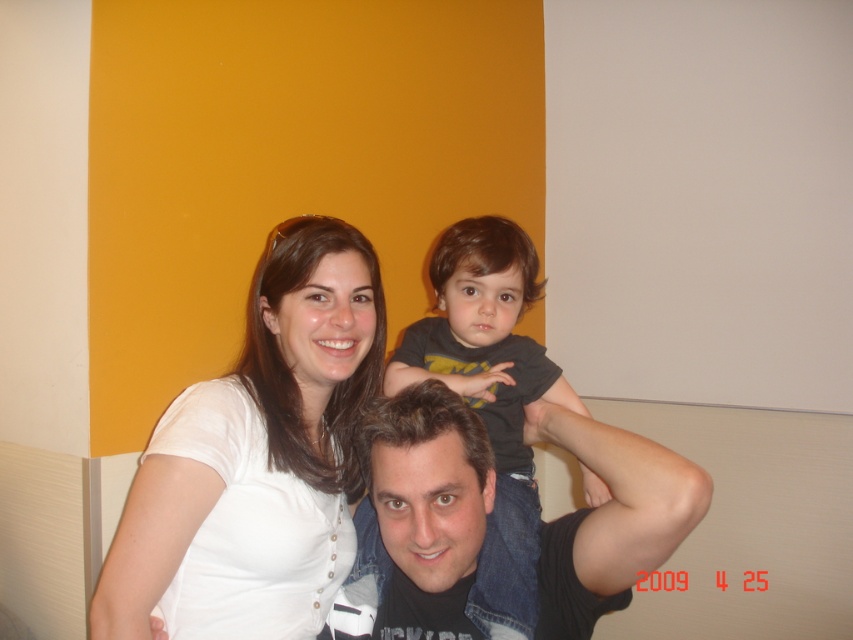
Question: Does white matte shirt at upper left have a smaller size compared to dark gray t-shirt at center?

Choices:
 (A) yes
 (B) no

Answer: (A)

Question: Is white matte shirt at upper center thinner than black matte shirt at center?

Choices:
 (A) no
 (B) yes

Answer: (A)

Question: Which point is farther to the camera?

Choices:
 (A) (583, 460)
 (B) (434, 324)
 (C) (631, 532)
 (D) (125, 515)

Answer: (B)

Question: Which point is closer to the camera taking this photo?

Choices:
 (A) (497, 358)
 (B) (398, 515)

Answer: (B)

Question: Is white matte shirt at upper center above black matte shirt at center?

Choices:
 (A) yes
 (B) no

Answer: (A)

Question: Which object is farther from the camera taking this photo?

Choices:
 (A) white matte shirt at upper left
 (B) white matte shirt at upper center
 (C) black matte shirt at center

Answer: (A)